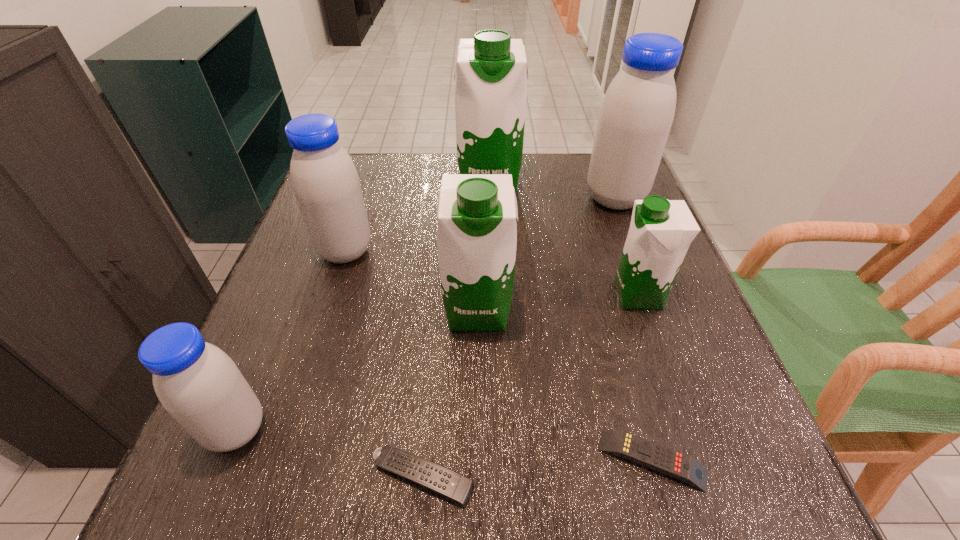
At what (x,y) coordinates should I click in order to perform the action: click on unoccupied area between the left remote control and the right remote control. Please return your answer as a coordinate pair (x, y). The height and width of the screenshot is (540, 960). Looking at the image, I should click on (538, 468).

Locate an element on the screen. vacant area between the left remote control and the smallest green soya milk is located at coordinates (531, 386).

Find the location of a particular element. The width and height of the screenshot is (960, 540). free space between the farthest blue soya milk and the second biggest green soya milk is located at coordinates (546, 254).

Locate an element on the screen. This screenshot has height=540, width=960. free space between the second biggest blue soya milk and the left remote control is located at coordinates (384, 364).

Where is `vacant space in between the left remote control and the nearest blue soya milk`? Image resolution: width=960 pixels, height=540 pixels. vacant space in between the left remote control and the nearest blue soya milk is located at coordinates (329, 453).

Identify the location of vacant point located between the second smallest blue soya milk and the second smallest green soya milk. (412, 280).

This screenshot has width=960, height=540. Identify the location of vacant area that lies between the biggest blue soya milk and the left remote control. (518, 338).

Where is `the sixth closest object relative to the rightmost green soya milk`? The image size is (960, 540). the sixth closest object relative to the rightmost green soya milk is located at coordinates (324, 179).

Find the location of a particular element. The image size is (960, 540). the sixth closest object relative to the left remote control is located at coordinates (637, 112).

Select which soya milk is the fifth closest to the smallest green soya milk. Please provide its 2D coordinates. Your answer should be formatted as a tuple, i.e. [(x, y)], where the tuple contains the x and y coordinates of a point satisfying the conditions above.

[(196, 382)]